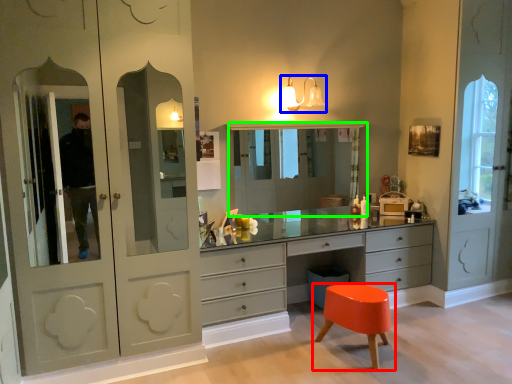
Question: Which object is the closest to the stool (highlighted by a red box)? Choose among these: light fixture (highlighted by a blue box) or medicine cabinet (highlighted by a green box).

Choices:
 (A) light fixture
 (B) medicine cabinet

Answer: (A)